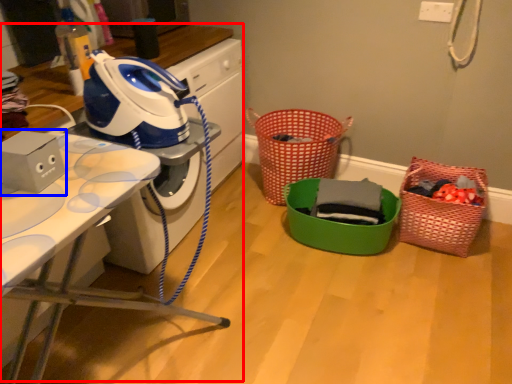
Question: Among these objects, which one is farthest to the camera, computer desk (highlighted by a red box) or appliance (highlighted by a blue box)?

Choices:
 (A) computer desk
 (B) appliance

Answer: (A)